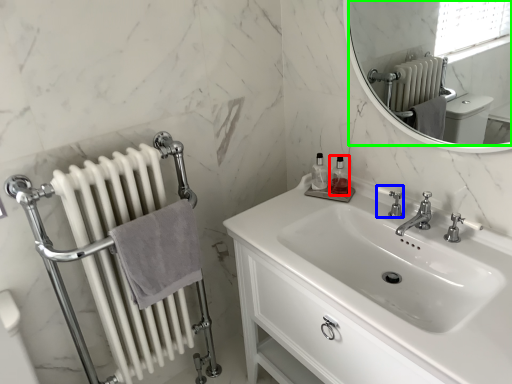
Question: Which object is positioned farthest from toiletry (highlighted by a red box)? Select from plumbing fixture (highlighted by a blue box) and mirror (highlighted by a green box).

Choices:
 (A) plumbing fixture
 (B) mirror

Answer: (B)